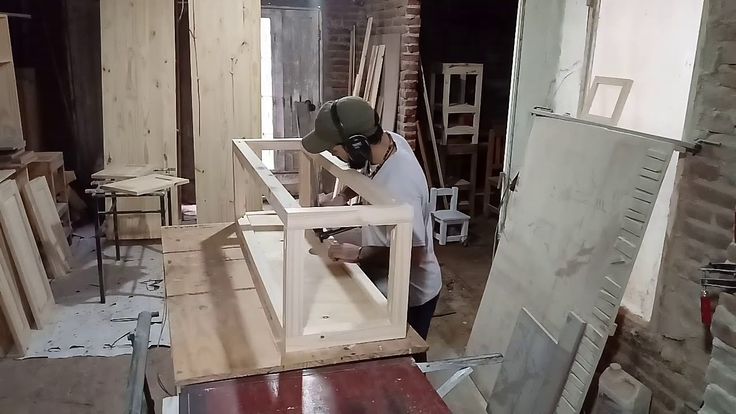
Where is `work table`? This screenshot has width=736, height=414. work table is located at coordinates 230,348.